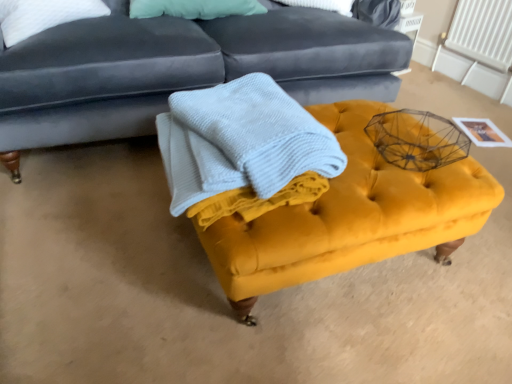
Question: Is point (192, 183) positioned closer to the camera than point (460, 49)?

Choices:
 (A) closer
 (B) farther

Answer: (A)

Question: Is light blue textured blanket at center inside or outside of white plastic radiator at upper right?

Choices:
 (A) inside
 (B) outside

Answer: (B)

Question: Which object is the closest to the white plastic radiator at upper right?

Choices:
 (A) velvet dark blue studio couch at upper center
 (B) velvet yellow ottoman at center
 (C) light blue textured blanket at center

Answer: (A)

Question: Estimate the real-world distances between objects in this image. Which object is closer to the velvet yellow ottoman at center?

Choices:
 (A) light blue textured blanket at center
 (B) velvet dark blue studio couch at upper center
 (C) white plastic radiator at upper right

Answer: (A)